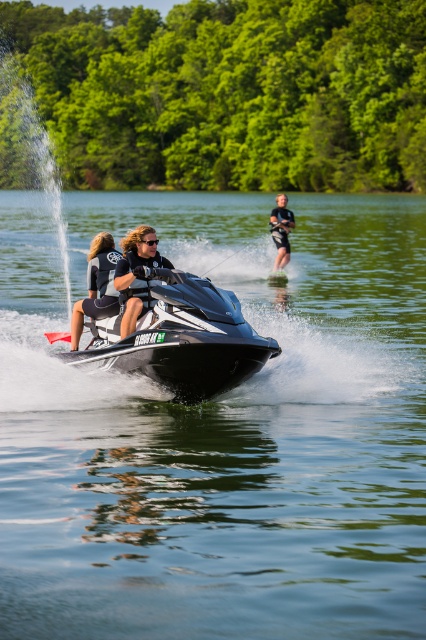
Who is lower down, shiny black jet ski at center or matte black life vest at center?

Positioned lower is shiny black jet ski at center.

Which of these two, shiny black jet ski at center or matte black life vest at center, stands taller?

shiny black jet ski at center

In order to click on shiny black jet ski at center in this screenshot , I will do `click(181, 339)`.

Is glossy black jet ski at center positioned before black wetsuit at upper right?

Yes, it is in front of black wetsuit at upper right.

Does glossy black jet ski at center have a larger size compared to black wetsuit at upper right?

Correct, glossy black jet ski at center is larger in size than black wetsuit at upper right.

Does point (238, 448) come in front of point (278, 250)?

That is True.

This screenshot has height=640, width=426. I want to click on glossy black jet ski at center, so click(221, 433).

Is point (221, 576) behind point (103, 234)?

No.

Does glossy black jet ski at center have a smaller size compared to matte black life vest at center?

No, glossy black jet ski at center is not smaller than matte black life vest at center.

Does point (2, 289) come behind point (80, 321)?

Yes, it is behind point (80, 321).

Locate an element on the screen. glossy black jet ski at center is located at coordinates (221, 433).